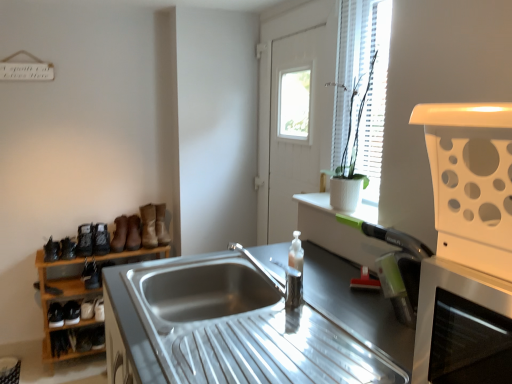
Question: From the image's perspective, relative to brown suede boot at lower left, which is the 3th boot from right to left, is wooden shoe rack at left above or below?

Choices:
 (A) above
 (B) below

Answer: (B)

Question: Considering the positions of wooden shoe rack at left and brown suede boot at lower left, the fifth boot in the left-to-right sequence, in the image, is wooden shoe rack at left wider or thinner than brown suede boot at lower left, the fifth boot in the left-to-right sequence,?

Choices:
 (A) wide
 (B) thin

Answer: (A)

Question: Which object is positioned farthest from the black leather shoe at lower left, which ranks as the third shoe in bottom-to-top order?

Choices:
 (A) matte black shoe at left, the first shoe viewed from the top
 (B) black leather shoe at lower left, positioned as the second shoe in bottom-to-top order
 (C) stainless steel sink at center
 (D) leather boot at left, placed as the fifth boot when sorted from right to left
 (E) brown suede boot at lower left, which is the 3th boot from right to left

Answer: (C)

Question: Which of these objects is positioned farthest from the black leather shoe at lower left, which is the 4th shoe from top to bottom?

Choices:
 (A) leather boot at left, the third boot when ordered from left to right
 (B) white plastic vent at right
 (C) stainless steel sink at center
 (D) leather boot at left, which appears as the 7th boot when viewed from the left
 (E) white wooden door at center

Answer: (B)